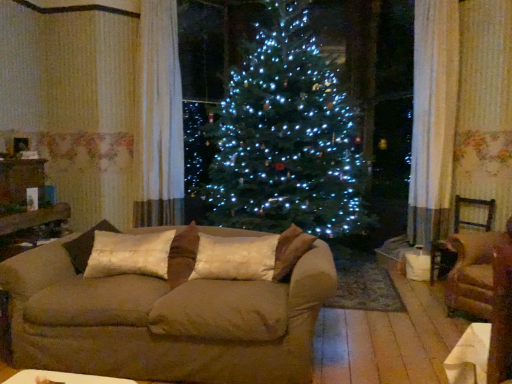
Question: Is silky beige pillow at center, arranged as the 2th pillow when viewed from the left, far away from brown fabric armchair at right, which is the 1th armchair in front-to-back order?

Choices:
 (A) yes
 (B) no

Answer: (A)

Question: Does silky beige pillow at center, arranged as the 2th pillow when viewed from the left, have a lesser height compared to brown fabric armchair at right, which is the 1th armchair in front-to-back order?

Choices:
 (A) no
 (B) yes

Answer: (B)

Question: From a real-world perspective, is silky beige pillow at center, arranged as the 2th pillow when viewed from the left, located higher than brown fabric armchair at right, which is counted as the 2th armchair, starting from the back?

Choices:
 (A) yes
 (B) no

Answer: (A)

Question: Does silky beige pillow at center, which is counted as the 1th pillow, starting from the right, appear on the right side of brown fabric armchair at right, which is the 1th armchair in front-to-back order?

Choices:
 (A) no
 (B) yes

Answer: (A)

Question: Can you confirm if silky beige pillow at center, arranged as the 2th pillow when viewed from the left, is smaller than brown fabric armchair at right, which is the 1th armchair in front-to-back order?

Choices:
 (A) no
 (B) yes

Answer: (B)

Question: From a real-world perspective, is white sheer curtain at upper left above or below suede couch at center?

Choices:
 (A) below
 (B) above

Answer: (B)

Question: From the image's perspective, relative to suede couch at center, is white sheer curtain at upper left above or below?

Choices:
 (A) above
 (B) below

Answer: (A)

Question: Is white sheer curtain at upper left to the left or to the right of suede couch at center in the image?

Choices:
 (A) left
 (B) right

Answer: (A)

Question: Is point [153, 144] closer or farther from the camera than point [154, 317]?

Choices:
 (A) farther
 (B) closer

Answer: (A)

Question: From the image's perspective, is silky beige pillow at center, which is counted as the 1th pillow, starting from the right, located above or below brown fabric armchair at right, which is the 1th armchair in front-to-back order?

Choices:
 (A) below
 (B) above

Answer: (B)

Question: Is silky beige pillow at center, which is counted as the 1th pillow, starting from the right, in front of or behind brown fabric armchair at right, which is the 1th armchair in front-to-back order, in the image?

Choices:
 (A) front
 (B) behind

Answer: (A)

Question: In terms of width, does silky beige pillow at center, which is counted as the 1th pillow, starting from the right, look wider or thinner when compared to brown fabric armchair at right, which is counted as the 2th armchair, starting from the back?

Choices:
 (A) thin
 (B) wide

Answer: (A)

Question: Considering the positions of silky beige pillow at center, which is counted as the 1th pillow, starting from the right, and brown fabric armchair at right, which is the 1th armchair in front-to-back order, in the image, is silky beige pillow at center, which is counted as the 1th pillow, starting from the right, bigger or smaller than brown fabric armchair at right, which is the 1th armchair in front-to-back order,?

Choices:
 (A) small
 (B) big

Answer: (A)

Question: Would you say brown fabric armchair at right, which is counted as the 1th armchair, starting from the back, is to the left or to the right of silky beige pillow at center, which is counted as the 1th pillow, starting from the right, in the picture?

Choices:
 (A) left
 (B) right

Answer: (B)

Question: Is point (477, 226) closer or farther from the camera than point (227, 276)?

Choices:
 (A) farther
 (B) closer

Answer: (A)